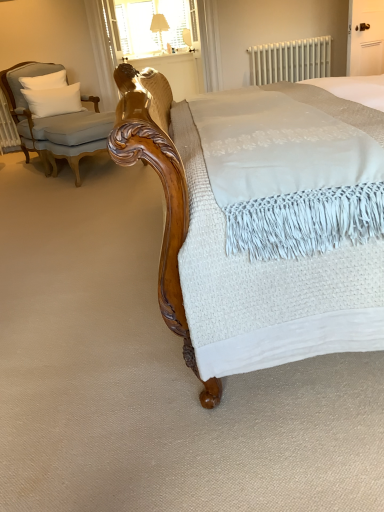
Question: Is light gray fabric chair at left positioned behind white metallic radiator at upper center?

Choices:
 (A) yes
 (B) no

Answer: (B)

Question: From a real-world perspective, is light gray fabric chair at left physically above white metallic radiator at upper center?

Choices:
 (A) no
 (B) yes

Answer: (A)

Question: Can white metallic radiator at upper center be found inside light gray fabric chair at left?

Choices:
 (A) yes
 (B) no

Answer: (B)

Question: From the image's perspective, is light gray fabric chair at left located above white metallic radiator at upper center?

Choices:
 (A) yes
 (B) no

Answer: (B)

Question: Is light gray fabric chair at left positioned beyond the bounds of white metallic radiator at upper center?

Choices:
 (A) no
 (B) yes

Answer: (B)

Question: From a real-world perspective, is light gray fabric chair at left physically below white metallic radiator at upper center?

Choices:
 (A) no
 (B) yes

Answer: (B)

Question: From the image's perspective, is light gray fabric chair at left over wooden balustrade at upper center?

Choices:
 (A) yes
 (B) no

Answer: (B)

Question: Are light gray fabric chair at left and wooden balustrade at upper center far apart?

Choices:
 (A) no
 (B) yes

Answer: (B)

Question: Does light gray fabric chair at left have a greater height compared to wooden balustrade at upper center?

Choices:
 (A) yes
 (B) no

Answer: (A)

Question: From the image's perspective, does light gray fabric chair at left appear lower than wooden balustrade at upper center?

Choices:
 (A) yes
 (B) no

Answer: (A)

Question: Does light gray fabric chair at left have a smaller size compared to wooden balustrade at upper center?

Choices:
 (A) no
 (B) yes

Answer: (B)

Question: From a real-world perspective, is light gray fabric chair at left over wooden balustrade at upper center?

Choices:
 (A) yes
 (B) no

Answer: (A)

Question: Is white metallic radiator at upper center shorter than matte cream fabric table lamp at upper center?

Choices:
 (A) yes
 (B) no

Answer: (A)